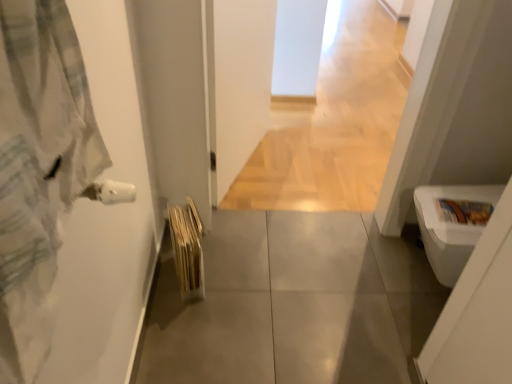
The width and height of the screenshot is (512, 384). In order to click on vacant region to the right of beige textured bath towel at lower left in this screenshot , I will do `click(230, 279)`.